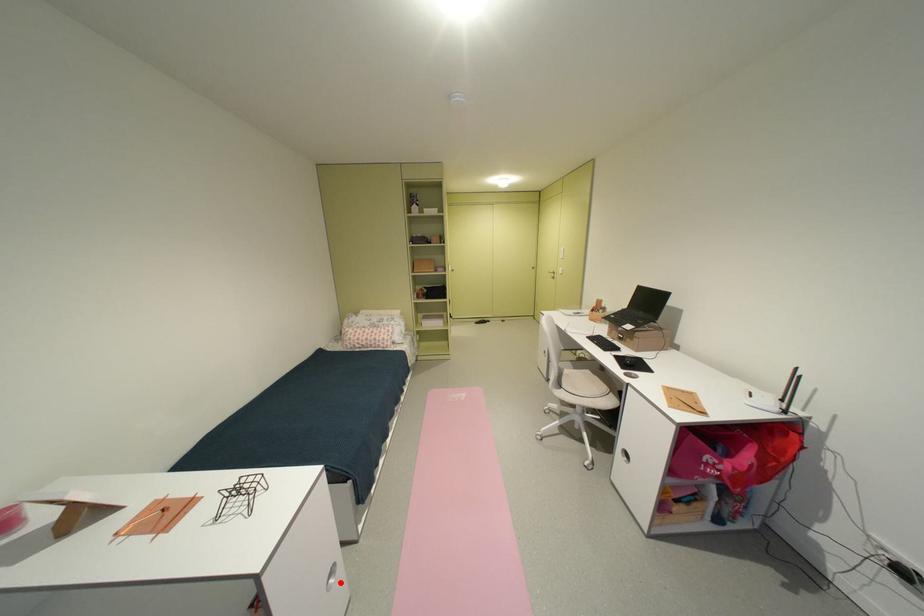
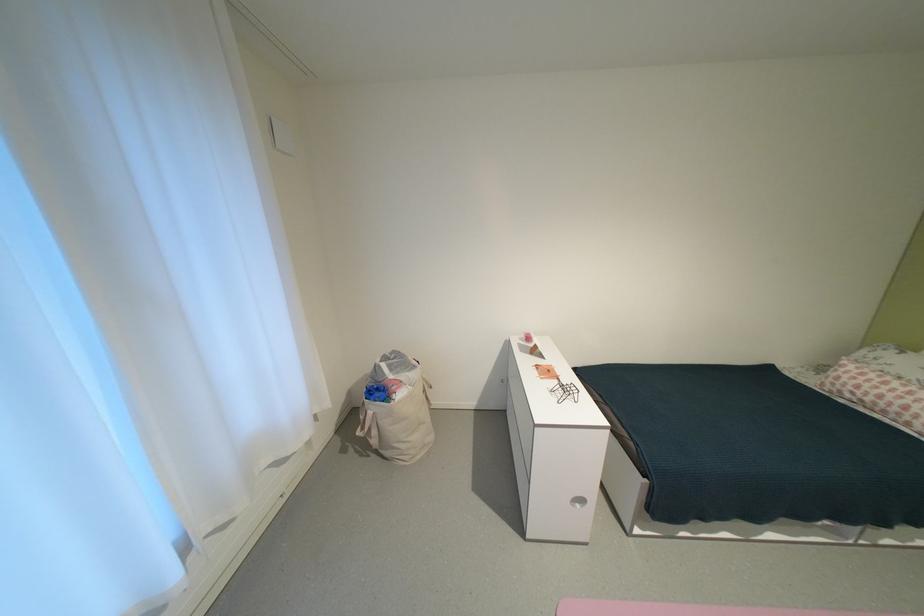
Find the pixel in the second image that matches the highlighted location in the first image.

(588, 506)